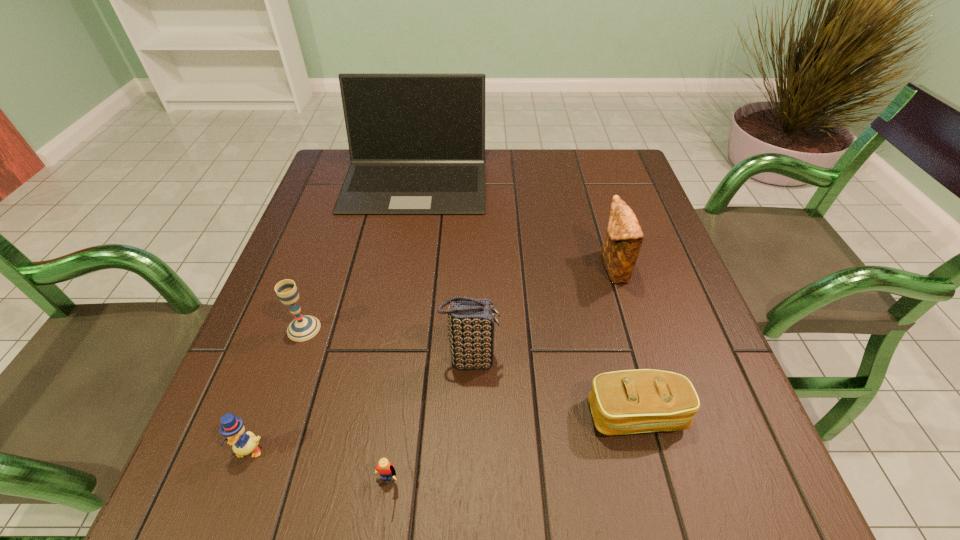
Find the location of a particular element. Image resolution: width=960 pixels, height=540 pixels. free point located on the screen of the laptop is located at coordinates (396, 289).

Identify the location of free space located 0.050m with the zip open on the leftmost clutch bag. (524, 360).

Where is `free space located 0.150m on the open side of the second farthest object`? This screenshot has width=960, height=540. free space located 0.150m on the open side of the second farthest object is located at coordinates (533, 268).

Where is `blank space located 0.080m on the open side of the second farthest object`? blank space located 0.080m on the open side of the second farthest object is located at coordinates (564, 268).

At what (x,y) coordinates should I click in order to perform the action: click on vacant space situated on the open side of the second farthest object. Please return your answer as a coordinate pair (x, y). This screenshot has width=960, height=540. Looking at the image, I should click on (428, 268).

Where is `vacant space located 0.130m on the back of the chalice`? The height and width of the screenshot is (540, 960). vacant space located 0.130m on the back of the chalice is located at coordinates (324, 271).

The image size is (960, 540). Find the location of `free space located 0.070m on the face of the duckling, where the monocle is placed`. free space located 0.070m on the face of the duckling, where the monocle is placed is located at coordinates (228, 509).

This screenshot has height=540, width=960. In order to click on free spot located 0.050m on the zipper side of the nearest clutch bag in this screenshot , I will do `click(652, 473)`.

At what (x,y) coordinates should I click in order to perform the action: click on object present at the far edge. Please return your answer as a coordinate pair (x, y). Looking at the image, I should click on (416, 141).

The height and width of the screenshot is (540, 960). I want to click on duckling at the near edge, so click(232, 427).